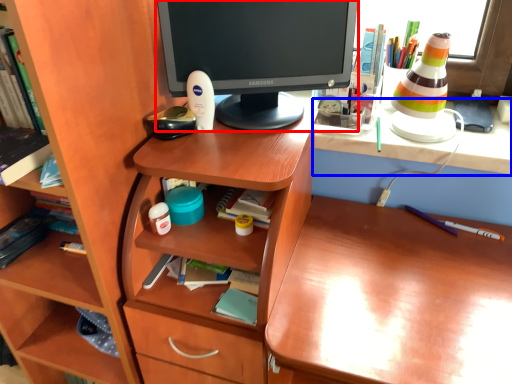
Question: Among these objects, which one is nearest to the camera, computer monitor (highlighted by a red box) or computer (highlighted by a blue box)?

Choices:
 (A) computer monitor
 (B) computer

Answer: (A)